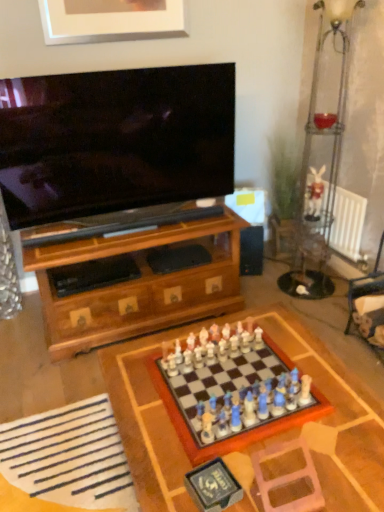
Identify the location of blank space above white fabric at lower left (from a real-world perspective). Image resolution: width=384 pixels, height=512 pixels. (58, 460).